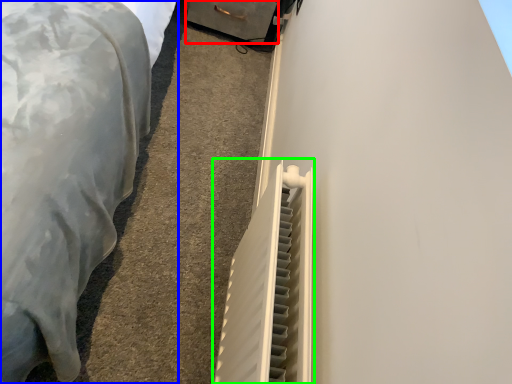
Question: Based on their relative distances, which object is nearer to drawer (highlighted by a red box)? Choose from furniture (highlighted by a blue box) and radiator (highlighted by a green box).

Choices:
 (A) furniture
 (B) radiator

Answer: (A)